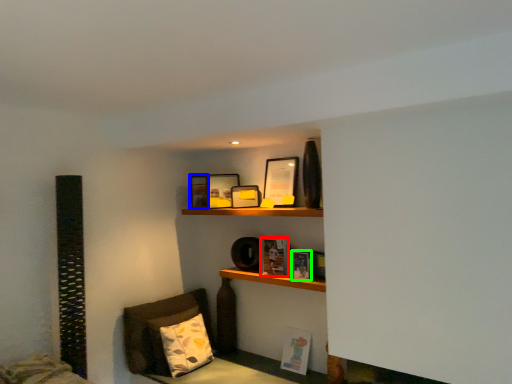
Question: Estimate the real-world distances between objects in this image. Which object is closer to book (highlighted by a red box), picture frame (highlighted by a blue box) or book (highlighted by a green box)?

Choices:
 (A) picture frame
 (B) book

Answer: (B)